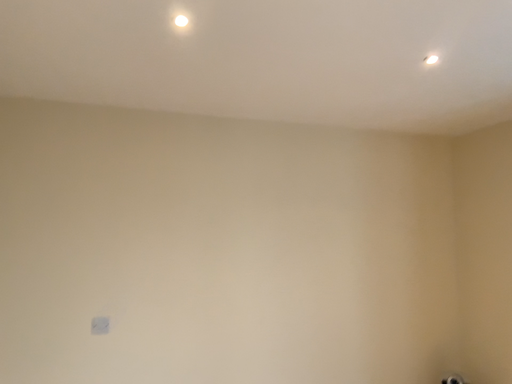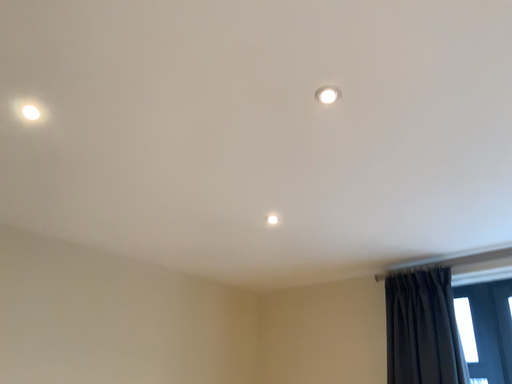
Question: How did the camera likely rotate when shooting the video?

Choices:
 (A) rotated downward
 (B) rotated upward

Answer: (B)